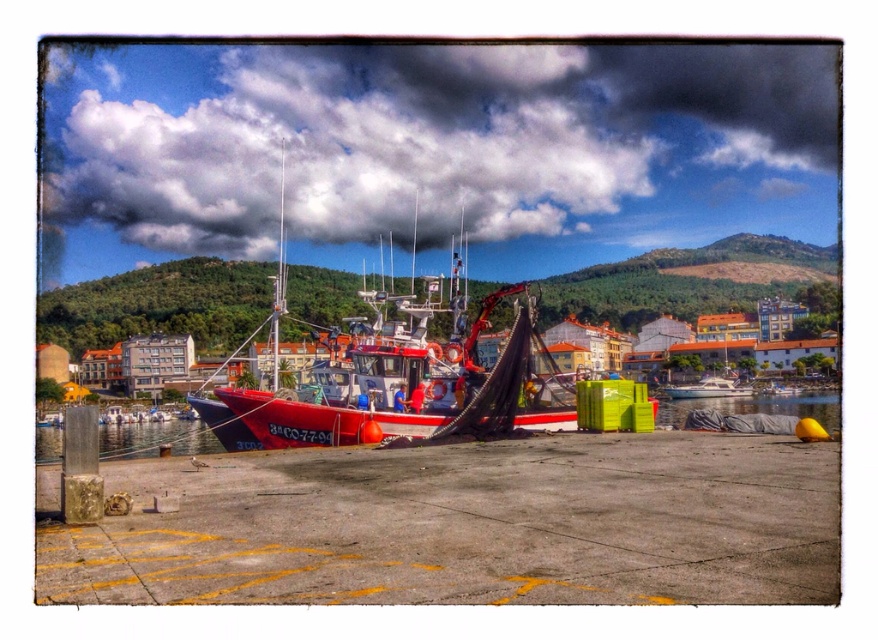
What do you see at coordinates (754, 406) in the screenshot? I see `black tarp at lower right` at bounding box center [754, 406].

Does black tarp at lower right appear on the left side of white glossy boat at center?

Correct, you'll find black tarp at lower right to the left of white glossy boat at center.

Who is more distant from viewer, (684, 412) or (730, 385)?

The point (730, 385) is behind.

Find the location of a particular element. black tarp at lower right is located at coordinates (754, 406).